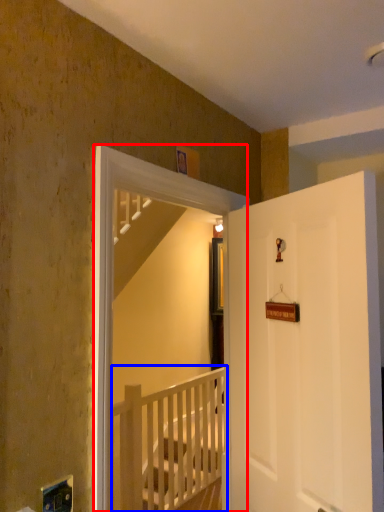
Question: Which object is closer to the camera taking this photo, screen door (highlighted by a red box) or rail (highlighted by a blue box)?

Choices:
 (A) screen door
 (B) rail

Answer: (A)